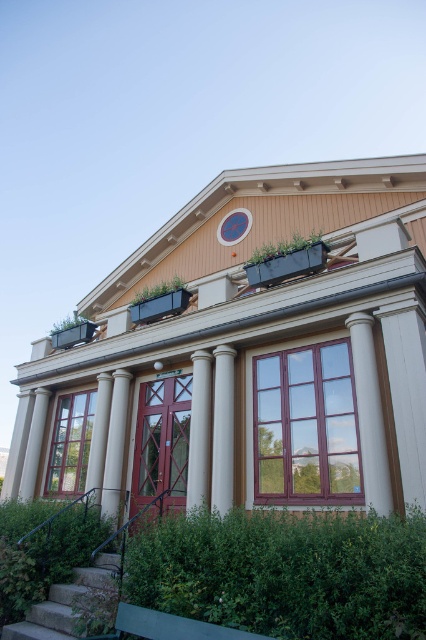
Question: Which of the following is the closest to the observer?

Choices:
 (A) (63, 317)
 (B) (268, 625)
 (C) (69, 436)

Answer: (B)

Question: Which point is farther to the camera?

Choices:
 (A) (123, 426)
 (B) (282, 243)

Answer: (B)

Question: Considering the relative positions of white glossy column at center and beige/smooth pillar at left in the image provided, where is white glossy column at center located with respect to beige/smooth pillar at left?

Choices:
 (A) left
 (B) right

Answer: (B)

Question: Observing the image, what is the correct spatial positioning of white smooth column at center in reference to white marble column at center?

Choices:
 (A) right
 (B) left

Answer: (A)

Question: Which of the following is the farthest from the observer?

Choices:
 (A) white marble column at center
 (B) stone stairs at lower left

Answer: (A)

Question: Is white smooth pillar at center positioned at the back of green matte planter at upper left?

Choices:
 (A) yes
 (B) no

Answer: (B)